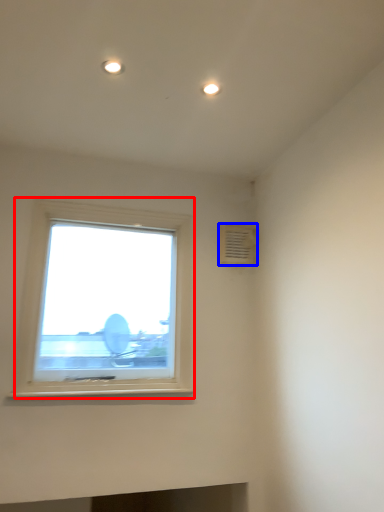
Question: Which point is further to the camera, window (highlighted by a red box) or air conditioning (highlighted by a blue box)?

Choices:
 (A) window
 (B) air conditioning

Answer: (B)